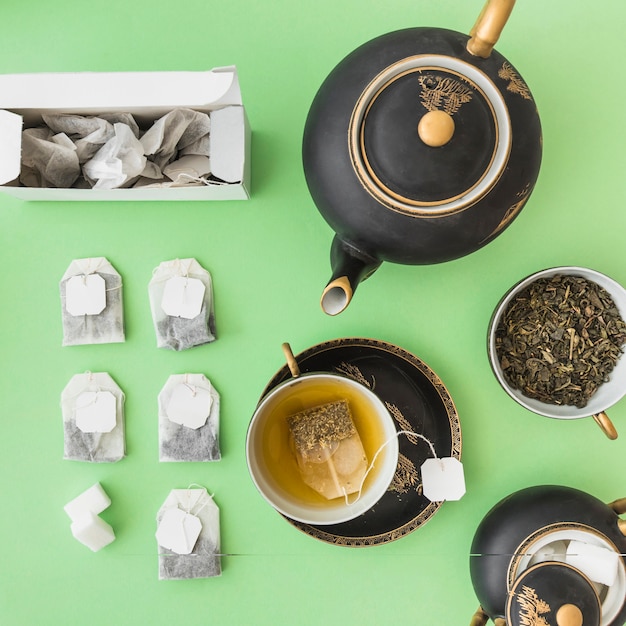
Identify the location of large teapot. This screenshot has width=626, height=626. (404, 235).